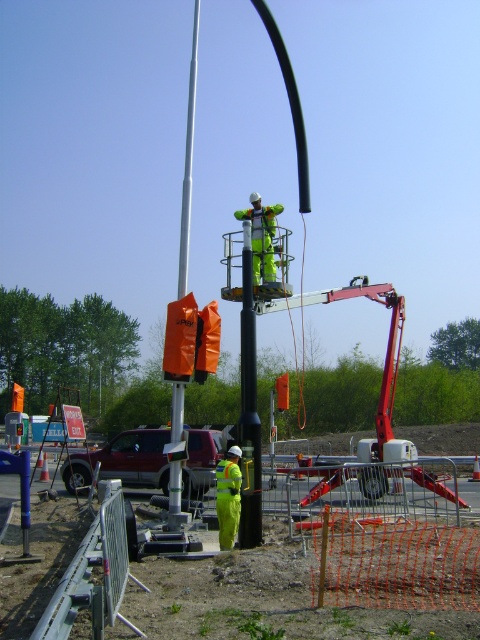
Question: Does black rubber pole at center appear over green reflective safety suit at center?

Choices:
 (A) yes
 (B) no

Answer: (B)

Question: Which point is farther to the camera?

Choices:
 (A) black rubber pole at center
 (B) white glossy pole at center
 (C) high visibility yellow reflective suit at center
 (D) green reflective safety suit at center

Answer: (D)

Question: Which point appears closest to the camera in this image?

Choices:
 (A) (223, 467)
 (B) (184, 243)
 (C) (263, 227)
 (D) (259, 496)

Answer: (D)

Question: Which point is closer to the camera?

Choices:
 (A) (249, 481)
 (B) (180, 248)

Answer: (A)

Question: Is black rubber pole at center bigger than white glossy pole at center?

Choices:
 (A) no
 (B) yes

Answer: (A)

Question: Can you confirm if black rubber pole at center is wider than green reflective safety suit at center?

Choices:
 (A) yes
 (B) no

Answer: (B)